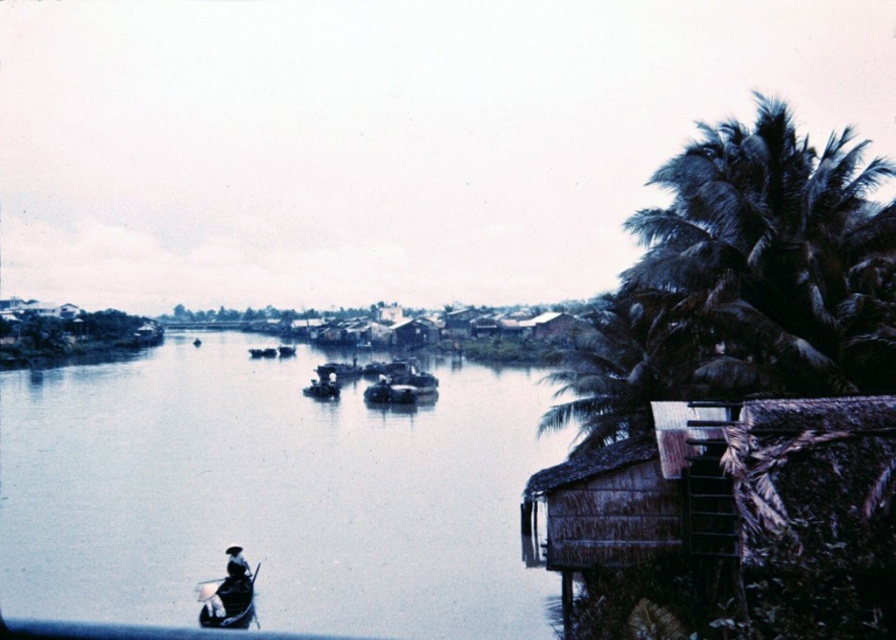
Who is more distant from viewer, [573,384] or [224,595]?

The point [573,384] is behind.

Is green leafy palm tree at right wider than wooden canoe at lower left?

Yes.

Between point (573, 394) and point (246, 612), which one is positioned behind?

Point (573, 394)

The width and height of the screenshot is (896, 640). I want to click on green leafy palm tree at right, so click(x=621, y=364).

Which is in front, point (160, 374) or point (653, 348)?

Point (653, 348) is in front.

Is smooth water at center to the right of green leafy palm tree at right from the viewer's perspective?

In fact, smooth water at center is to the left of green leafy palm tree at right.

Who is more distant from viewer, (56, 394) or (604, 355)?

Point (56, 394)

The height and width of the screenshot is (640, 896). Find the location of `smooth water at center`. smooth water at center is located at coordinates click(271, 493).

Is dark green leafy palm tree at right below wooden canoe at lower left?

Actually, dark green leafy palm tree at right is above wooden canoe at lower left.

Does dark green leafy palm tree at right have a lesser height compared to wooden canoe at lower left?

Incorrect, dark green leafy palm tree at right's height does not fall short of wooden canoe at lower left's.

This screenshot has height=640, width=896. I want to click on dark green leafy palm tree at right, so click(x=776, y=257).